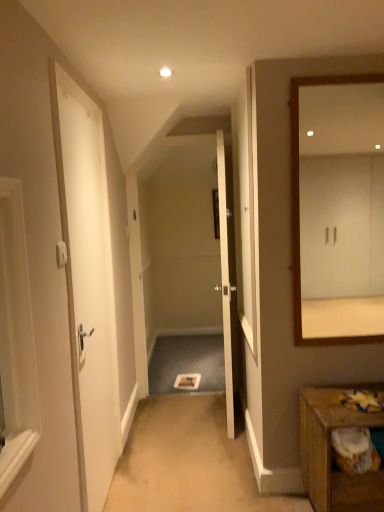
Question: Choose the correct answer: Is wooden table at lower right inside white matte door at left, placed as the 1th door when sorted from front to back, or outside it?

Choices:
 (A) inside
 (B) outside

Answer: (B)

Question: Considering their positions, is wooden table at lower right located in front of or behind white matte door at left, placed as the 1th door when sorted from front to back?

Choices:
 (A) front
 (B) behind

Answer: (B)

Question: Which object is positioned closest to the wooden table at lower right?

Choices:
 (A) white matte door at left, placed as the 1th door when sorted from front to back
 (B) white glossy door at center, the first door from the right
 (C) white wooden mirror at right

Answer: (B)

Question: Which of these objects is positioned closest to the white glossy door at center, the first door viewed from the back?

Choices:
 (A) white wooden mirror at right
 (B) wooden table at lower right
 (C) white matte door at left, which is the 2th door in back-to-front order

Answer: (B)